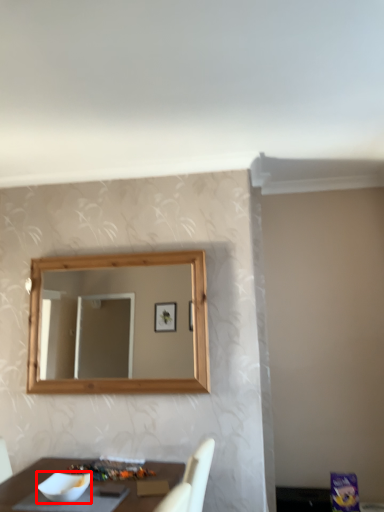
Question: Considering the relative positions of bowl (annotated by the red box) and food in the image provided, where is bowl (annotated by the red box) located with respect to the staircase?

Choices:
 (A) right
 (B) left

Answer: (B)